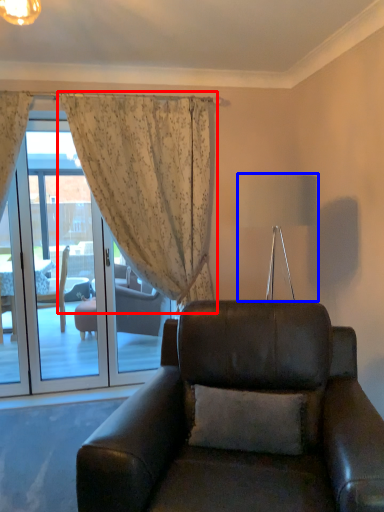
Question: Which of the following is the farthest to the observer, curtain (highlighted by a red box) or lamp (highlighted by a blue box)?

Choices:
 (A) curtain
 (B) lamp

Answer: (A)